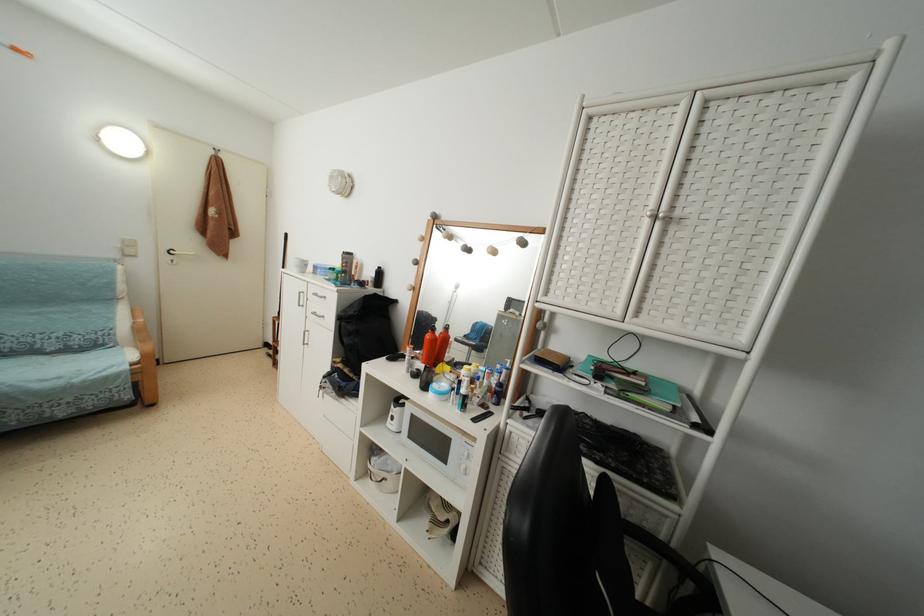
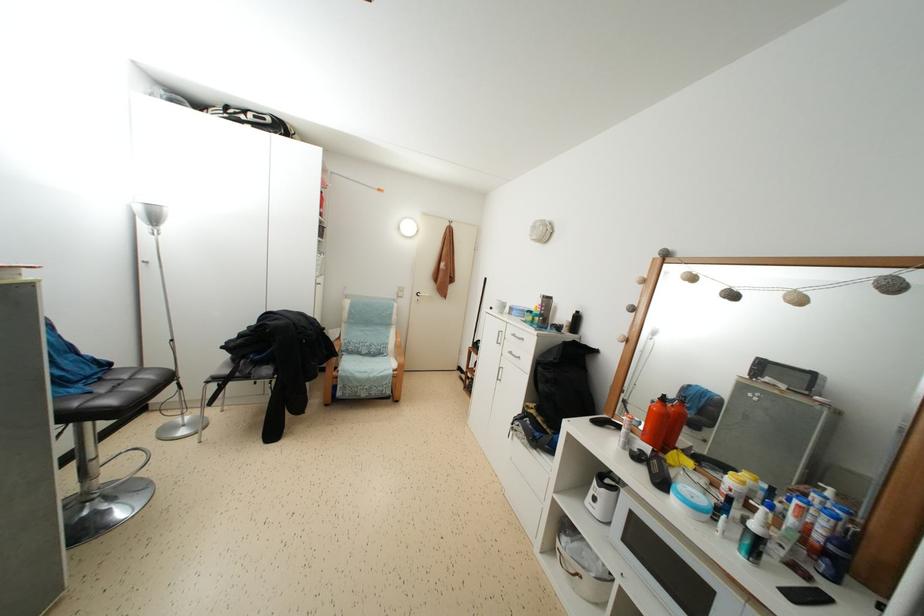
Question: The camera is either moving clockwise (left) or counter-clockwise (right) around the object. The first image is from the beginning of the video and the second image is from the end. Is the camera moving left or right when shooting the video?

Choices:
 (A) Left
 (B) Right

Answer: (B)